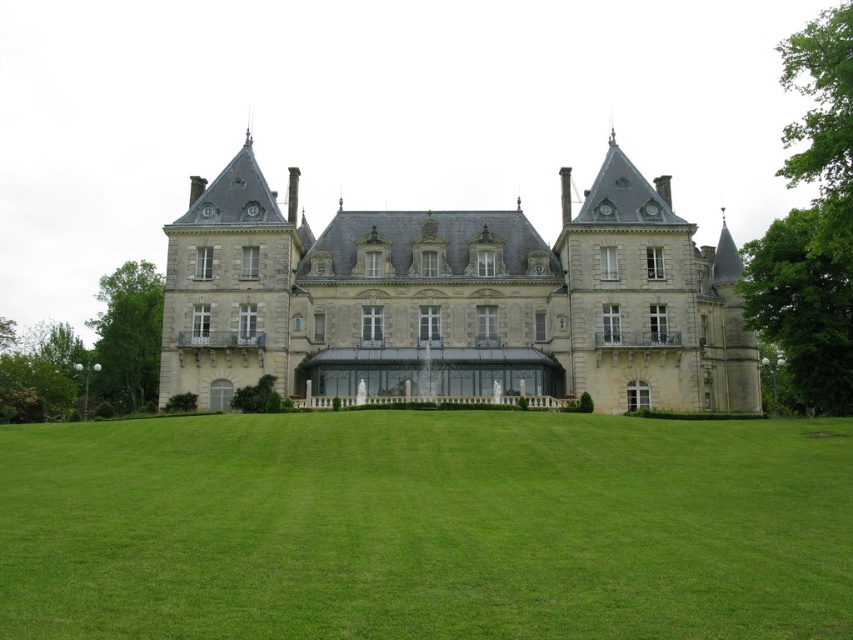
From the picture: You are standing in front of the gray stone castle at center and want to walk to the fountain located on the green grass at center. Which direction should you move to reach the fountain?

The green grass at center is to the left of the gray stone castle at center, so you should move to your left to reach the fountain located there.

Consider the image. You are a gardener who needs to mow the green grass at center. The gray stone castle at center is in the way. Can you mow the grass without moving the castle?

The green grass at center has a lesser height compared to gray stone castle at center, so yes, you can mow the green grass at center without moving the gray stone castle at center because the grass is shorter than the castle.

You are planning to host a garden party and need to set up a stage. The stage requires a space that is wider than the gray stone castle at center. Can the green grass at center provide enough space for this?

The green grass at center might be wider than the gray stone castle at center, so it could potentially provide enough space for the stage.